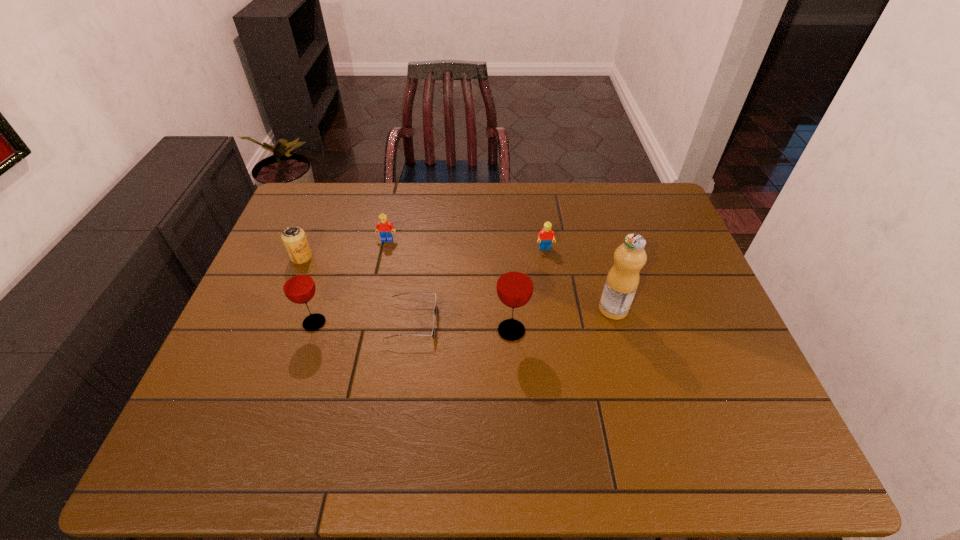
Find the location of a particular element. This screenshot has height=540, width=960. the left glass is located at coordinates (298, 285).

Where is `the shorter glass`? the shorter glass is located at coordinates (298, 285).

Identify the location of the fifth object from left to right. This screenshot has height=540, width=960. (515, 282).

Identify the location of the taller glass. (515, 282).

This screenshot has width=960, height=540. What are the coordinates of `the farthest object` in the screenshot? It's located at (384, 227).

Find the location of a particular element. The width and height of the screenshot is (960, 540). the farther Lego is located at coordinates (384, 227).

The width and height of the screenshot is (960, 540). Find the location of `the sixth object from left to right`. the sixth object from left to right is located at coordinates (546, 235).

This screenshot has width=960, height=540. In order to click on the nearer Lego in this screenshot , I will do `click(546, 235)`.

What are the coordinates of `beer can` in the screenshot? It's located at (x=294, y=238).

I want to click on the rightmost object, so click(622, 280).